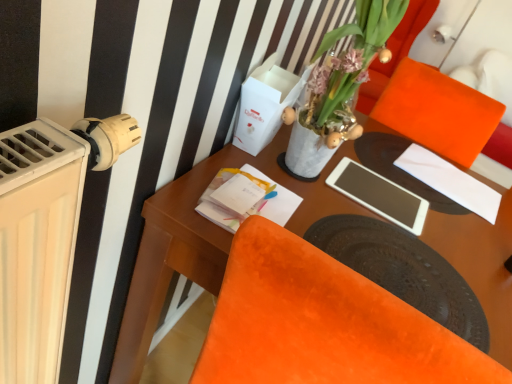
Question: Is the position of wooden desk at center more distant than that of translucent glass vase at upper center?

Choices:
 (A) yes
 (B) no

Answer: (B)

Question: Would you say wooden desk at center is a long distance from translucent glass vase at upper center?

Choices:
 (A) no
 (B) yes

Answer: (A)

Question: From a real-world perspective, is wooden desk at center physically above translucent glass vase at upper center?

Choices:
 (A) yes
 (B) no

Answer: (B)

Question: Can you confirm if wooden desk at center is bigger than translucent glass vase at upper center?

Choices:
 (A) no
 (B) yes

Answer: (B)

Question: Considering the relative sizes of wooden desk at center and translucent glass vase at upper center in the image provided, is wooden desk at center thinner than translucent glass vase at upper center?

Choices:
 (A) yes
 (B) no

Answer: (B)

Question: In the image, is translucent glass vase at upper center on the left side or the right side of white matte tablet at center?

Choices:
 (A) left
 (B) right

Answer: (A)

Question: Looking at the image, does translucent glass vase at upper center seem bigger or smaller compared to white matte tablet at center?

Choices:
 (A) big
 (B) small

Answer: (A)

Question: Considering their positions, is translucent glass vase at upper center located in front of or behind white matte tablet at center?

Choices:
 (A) behind
 (B) front

Answer: (B)

Question: In terms of width, does translucent glass vase at upper center look wider or thinner when compared to white matte tablet at center?

Choices:
 (A) wide
 (B) thin

Answer: (A)

Question: In the image, is white paper at upper right positioned in front of or behind translucent glass vase at upper center?

Choices:
 (A) front
 (B) behind

Answer: (B)

Question: From the image's perspective, is white paper at upper right located above or below translucent glass vase at upper center?

Choices:
 (A) below
 (B) above

Answer: (A)

Question: From a real-world perspective, is white paper at upper right positioned above or below translucent glass vase at upper center?

Choices:
 (A) below
 (B) above

Answer: (A)

Question: Visually, is white paper at upper right positioned to the left or to the right of translucent glass vase at upper center?

Choices:
 (A) left
 (B) right

Answer: (B)

Question: Is velvet orange chair at lower right in front of or behind translucent glass vase at upper center in the image?

Choices:
 (A) front
 (B) behind

Answer: (A)

Question: From a real-world perspective, is velvet orange chair at lower right above or below translucent glass vase at upper center?

Choices:
 (A) below
 (B) above

Answer: (A)